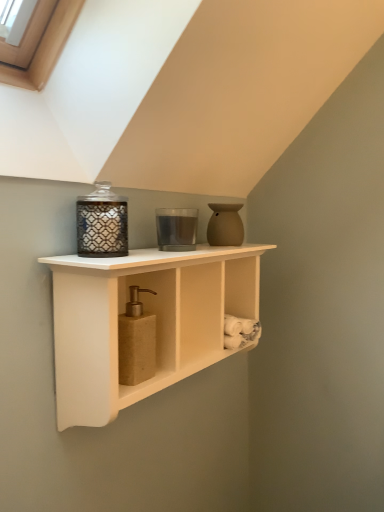
Question: In which direction should I rotate to look at translucent glass candle at center, marked as the second candle holder in a front-to-back arrangement?

Choices:
 (A) left
 (B) right

Answer: (A)

Question: Is translucent glass candle at center, acting as the first candle holder starting from the back, at the right side of matte glass candle holder at upper left, which is the 1th candle holder from front to back?

Choices:
 (A) no
 (B) yes

Answer: (B)

Question: Is translucent glass candle at center, the first candle holder positioned from the right, smaller than matte glass candle holder at upper left, positioned as the 2th candle holder in right-to-left order?

Choices:
 (A) no
 (B) yes

Answer: (B)

Question: Is the surface of translucent glass candle at center, the first candle holder positioned from the right, in direct contact with matte glass candle holder at upper left, positioned as the 2th candle holder in right-to-left order?

Choices:
 (A) no
 (B) yes

Answer: (A)

Question: Can you confirm if translucent glass candle at center, the first candle holder positioned from the right, is bigger than matte glass candle holder at upper left, the second candle holder positioned from the back?

Choices:
 (A) no
 (B) yes

Answer: (A)

Question: Considering the relative sizes of translucent glass candle at center, the first candle holder positioned from the right, and matte glass candle holder at upper left, which is the 1th candle holder from front to back, in the image provided, is translucent glass candle at center, the first candle holder positioned from the right, thinner than matte glass candle holder at upper left, which is the 1th candle holder from front to back,?

Choices:
 (A) yes
 (B) no

Answer: (A)

Question: From the image's perspective, does translucent glass candle at center, the first candle holder positioned from the right, appear lower than matte glass candle holder at upper left, which is the 1th candle holder from front to back?

Choices:
 (A) yes
 (B) no

Answer: (B)

Question: Is translucent glass candle at center, acting as the first candle holder starting from the back, wider than matte brown soap dispenser at center?

Choices:
 (A) no
 (B) yes

Answer: (B)

Question: Considering the relative positions of translucent glass candle at center, the first candle holder positioned from the right, and matte brown soap dispenser at center in the image provided, is translucent glass candle at center, the first candle holder positioned from the right, to the right of matte brown soap dispenser at center from the viewer's perspective?

Choices:
 (A) yes
 (B) no

Answer: (A)

Question: Considering the relative sizes of translucent glass candle at center, which appears as the second candle holder when viewed from the left, and matte brown soap dispenser at center in the image provided, is translucent glass candle at center, which appears as the second candle holder when viewed from the left, shorter than matte brown soap dispenser at center?

Choices:
 (A) yes
 (B) no

Answer: (A)

Question: Is the depth of translucent glass candle at center, which appears as the second candle holder when viewed from the left, greater than that of matte brown soap dispenser at center?

Choices:
 (A) yes
 (B) no

Answer: (A)

Question: From the image's perspective, is translucent glass candle at center, acting as the first candle holder starting from the back, above matte brown soap dispenser at center?

Choices:
 (A) yes
 (B) no

Answer: (A)

Question: Can you confirm if translucent glass candle at center, which appears as the second candle holder when viewed from the left, is smaller than matte brown soap dispenser at center?

Choices:
 (A) no
 (B) yes

Answer: (B)

Question: Does matte glass candle holder at upper left, the second candle holder positioned from the back, turn towards translucent glass candle at center, the first candle holder positioned from the right?

Choices:
 (A) no
 (B) yes

Answer: (A)